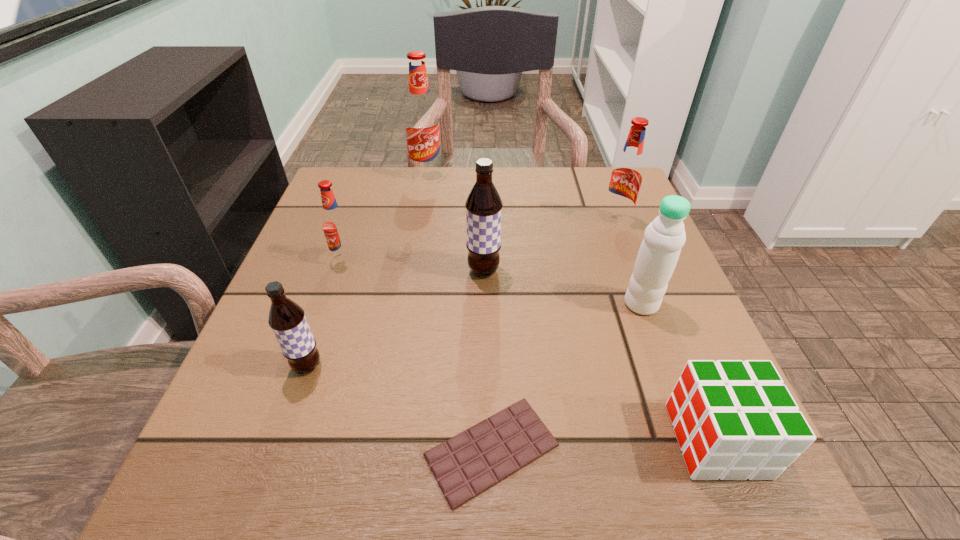
Where is `the farthest root beer`? the farthest root beer is located at coordinates (422, 126).

This screenshot has height=540, width=960. Identify the location of the sixth object from right to left. (422, 126).

Identify the location of the fourth nearest root beer. The width and height of the screenshot is (960, 540). (626, 176).

Identify the location of the second nearest red root beer. (626, 176).

At what (x,y) coordinates should I click in order to perform the action: click on the fourth root beer from left to right. Please return your answer as a coordinate pair (x, y). The height and width of the screenshot is (540, 960). Looking at the image, I should click on (483, 205).

Locate an element on the screen. Image resolution: width=960 pixels, height=540 pixels. the right brown root beer is located at coordinates (483, 205).

Where is `the fourth nearest object`? The image size is (960, 540). the fourth nearest object is located at coordinates (664, 237).

Locate an element on the screen. white water bottle is located at coordinates (664, 237).

This screenshot has width=960, height=540. I want to click on the nearest red root beer, so click(335, 224).

Find the location of a particular element. The height and width of the screenshot is (540, 960). the leftmost red root beer is located at coordinates (335, 224).